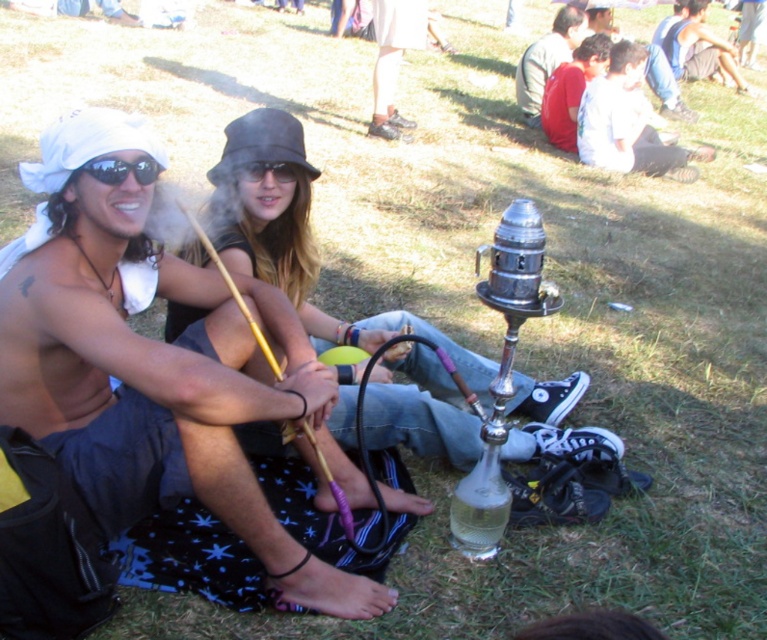
Does blue denim shorts at lower right appear over denim jacket at upper right?

Indeed, blue denim shorts at lower right is positioned over denim jacket at upper right.

The image size is (767, 640). What do you see at coordinates (700, 49) in the screenshot? I see `blue denim shorts at lower right` at bounding box center [700, 49].

The width and height of the screenshot is (767, 640). What are the coordinates of `blue denim shorts at lower right` in the screenshot? It's located at (700, 49).

Looking at this image, is matte black shorts at left taller than blue denim shorts at lower right?

Yes.

Between matte black shorts at left and blue denim shorts at lower right, which one has more height?

With more height is matte black shorts at left.

This screenshot has height=640, width=767. I want to click on matte black shorts at left, so click(x=156, y=365).

Is matte black hookah at center below white cotton shirt at upper right?

Indeed, matte black hookah at center is positioned under white cotton shirt at upper right.

Is matte black hookah at center positioned before white cotton shirt at upper right?

Yes, it is.

The width and height of the screenshot is (767, 640). What are the coordinates of `matte black hookah at center` in the screenshot? It's located at (298, 237).